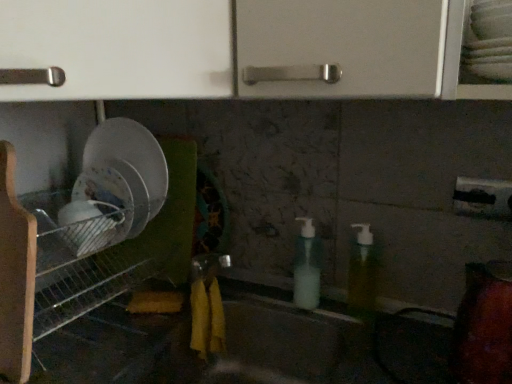
Question: Considering their positions, is matte gray sink at center located in front of or behind translucent plastic soap dispenser at center, the second soap dispenser in the left-to-right sequence?

Choices:
 (A) behind
 (B) front

Answer: (B)

Question: Which is correct: matte gray sink at center is inside translucent plastic soap dispenser at center, positioned as the first soap dispenser in right-to-left order, or outside of it?

Choices:
 (A) inside
 (B) outside

Answer: (B)

Question: Considering the real-world distances, which object is closest to the translucent plastic soap dispenser at center, the second soap dispenser in the left-to-right sequence?

Choices:
 (A) metallic wire rack at left
 (B) matte gray sink at center
 (C) translucent plastic soap dispenser at center, which appears as the second soap dispenser when viewed from the right

Answer: (C)

Question: Which object is positioned farthest from the matte gray sink at center?

Choices:
 (A) translucent plastic soap dispenser at center, which is counted as the 1th soap dispenser, starting from the left
 (B) translucent plastic soap dispenser at center, positioned as the first soap dispenser in right-to-left order
 (C) metallic wire rack at left

Answer: (C)